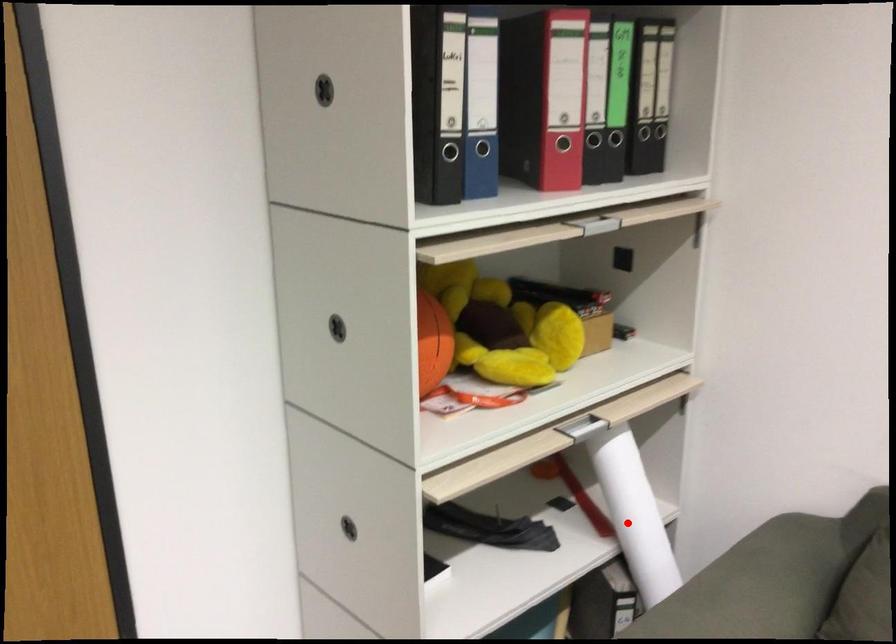
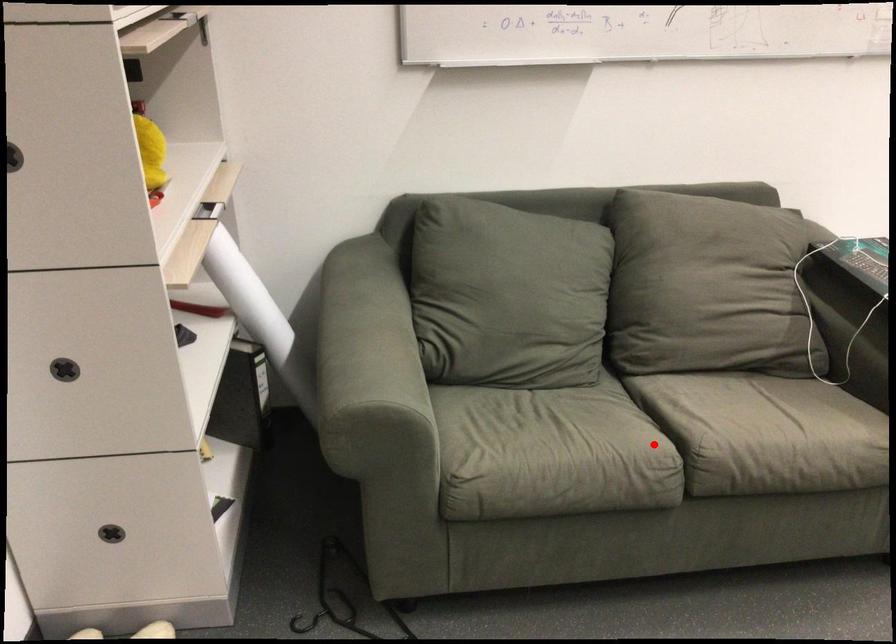
I am providing you with two images of the same scene from different viewpoints. A red point is marked on the first image and another point is marked on the second image. Are the points marked in image1 and image2 representing the same 3D position?

No